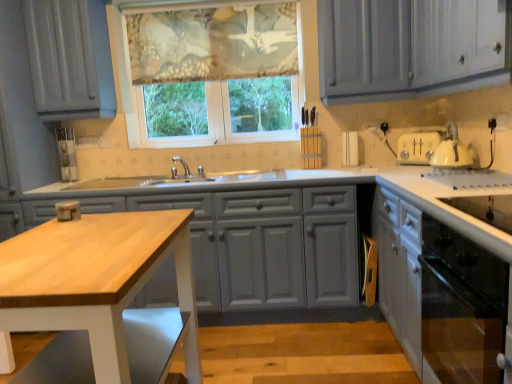
Question: Does translucent floral fabric at center have a larger size compared to white glossy cabinet at lower right, which appears as the 2th cabinetry when viewed from the left?

Choices:
 (A) no
 (B) yes

Answer: (A)

Question: Does translucent floral fabric at center appear on the right side of white glossy cabinet at lower right, which appears as the 2th cabinetry when viewed from the left?

Choices:
 (A) no
 (B) yes

Answer: (A)

Question: Is translucent floral fabric at center closer to camera compared to white glossy cabinet at lower right, which appears as the 2th cabinetry when viewed from the left?

Choices:
 (A) no
 (B) yes

Answer: (A)

Question: From the image's perspective, would you say translucent floral fabric at center is positioned over white glossy cabinet at lower right, which is the first cabinetry in right-to-left order?

Choices:
 (A) no
 (B) yes

Answer: (B)

Question: Does translucent floral fabric at center have a greater width compared to white glossy cabinet at lower right, which is the first cabinetry in right-to-left order?

Choices:
 (A) no
 (B) yes

Answer: (A)

Question: From the image's perspective, is translucent floral fabric at center located above or below white glossy cabinet at lower right, which is the first cabinetry in right-to-left order?

Choices:
 (A) below
 (B) above

Answer: (B)

Question: Is point (203, 132) closer or farther from the camera than point (482, 337)?

Choices:
 (A) farther
 (B) closer

Answer: (A)

Question: Considering their positions, is translucent floral fabric at center located in front of or behind white glossy cabinet at lower right, which appears as the 2th cabinetry when viewed from the left?

Choices:
 (A) front
 (B) behind

Answer: (B)

Question: Considering the positions of translucent floral fabric at center and white glossy cabinet at lower right, which appears as the 2th cabinetry when viewed from the left, in the image, is translucent floral fabric at center wider or thinner than white glossy cabinet at lower right, which appears as the 2th cabinetry when viewed from the left,?

Choices:
 (A) wide
 (B) thin

Answer: (B)

Question: Considering the positions of matte gray cabinets at center, marked as the first cabinetry in a left-to-right arrangement, and textured floral fabric at upper center in the image, is matte gray cabinets at center, marked as the first cabinetry in a left-to-right arrangement, wider or thinner than textured floral fabric at upper center?

Choices:
 (A) thin
 (B) wide

Answer: (B)

Question: Considering the positions of matte gray cabinets at center, the second cabinetry in the right-to-left sequence, and textured floral fabric at upper center in the image, is matte gray cabinets at center, the second cabinetry in the right-to-left sequence, bigger or smaller than textured floral fabric at upper center?

Choices:
 (A) small
 (B) big

Answer: (B)

Question: Is point (349, 276) positioned closer to the camera than point (222, 26)?

Choices:
 (A) farther
 (B) closer

Answer: (B)

Question: From a real-world perspective, is matte gray cabinets at center, marked as the first cabinetry in a left-to-right arrangement, physically located above or below textured floral fabric at upper center?

Choices:
 (A) above
 (B) below

Answer: (B)

Question: Considering the positions of matte gray cabinets at center, marked as the first cabinetry in a left-to-right arrangement, and wooden table at center in the image, is matte gray cabinets at center, marked as the first cabinetry in a left-to-right arrangement, taller or shorter than wooden table at center?

Choices:
 (A) tall
 (B) short

Answer: (A)

Question: From a real-world perspective, relative to wooden table at center, is matte gray cabinets at center, marked as the first cabinetry in a left-to-right arrangement, vertically above or below?

Choices:
 (A) below
 (B) above

Answer: (A)